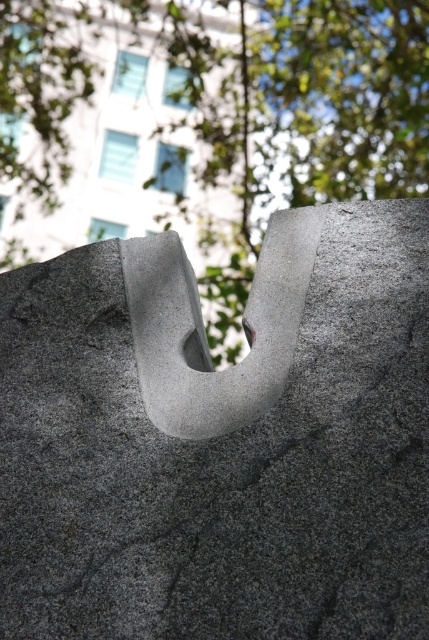
Question: Which point is closer to the camera?

Choices:
 (A) green leafy tree at upper center
 (B) gray granite stone at center

Answer: (B)

Question: Is gray granite stone at center above green leafy tree at upper center?

Choices:
 (A) yes
 (B) no

Answer: (B)

Question: Is the position of gray granite stone at center less distant than that of green leafy tree at upper center?

Choices:
 (A) yes
 (B) no

Answer: (A)

Question: Does gray granite stone at center have a smaller size compared to green leafy tree at upper center?

Choices:
 (A) yes
 (B) no

Answer: (A)